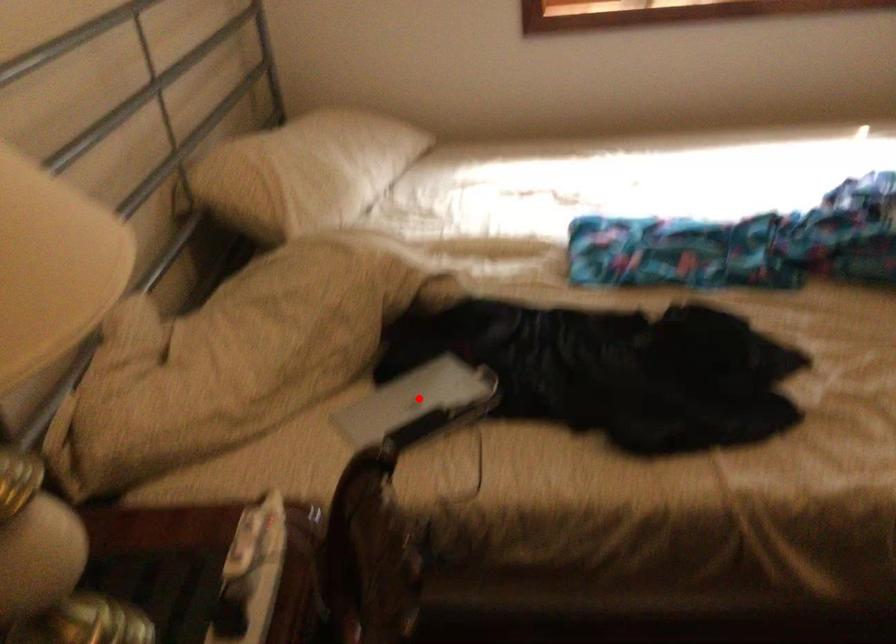
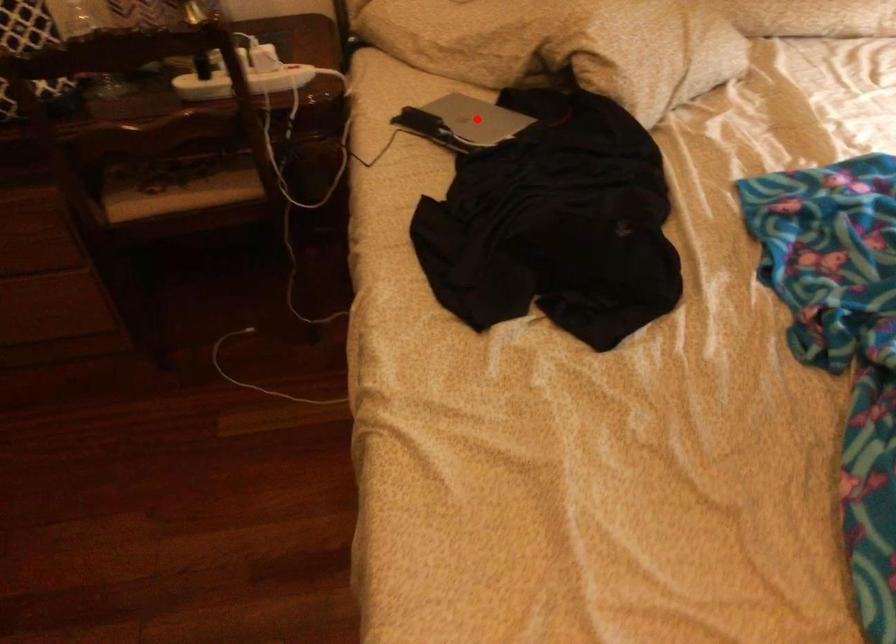
I am providing you with two images of the same scene from different viewpoints. A red point is marked on the first image and another point is marked on the second image. Does the point marked in image1 correspond to the same location as the one in image2?

Yes